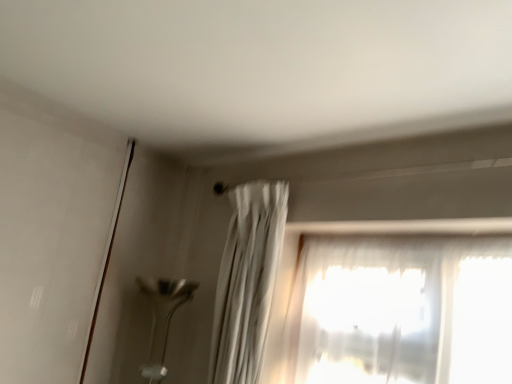
In order to face white sheer curtain at center, should I rotate leftwards or rightwards?

Rotate your view left by about 2.876°.

I want to click on white sheer curtain at center, so click(247, 281).

The height and width of the screenshot is (384, 512). What do you see at coordinates (247, 281) in the screenshot?
I see `white sheer curtain at center` at bounding box center [247, 281].

Where is `white sheer curtain at center`? The width and height of the screenshot is (512, 384). white sheer curtain at center is located at coordinates (247, 281).